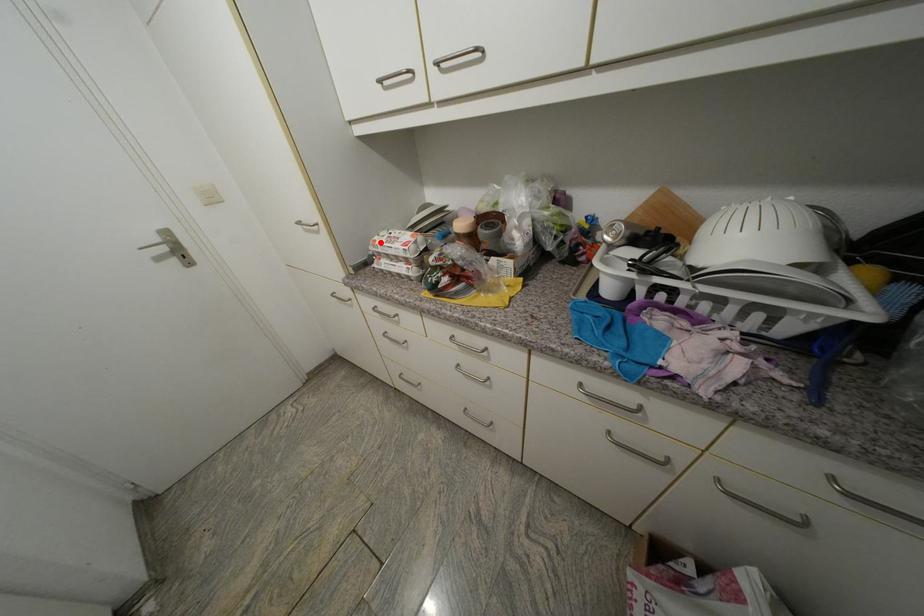
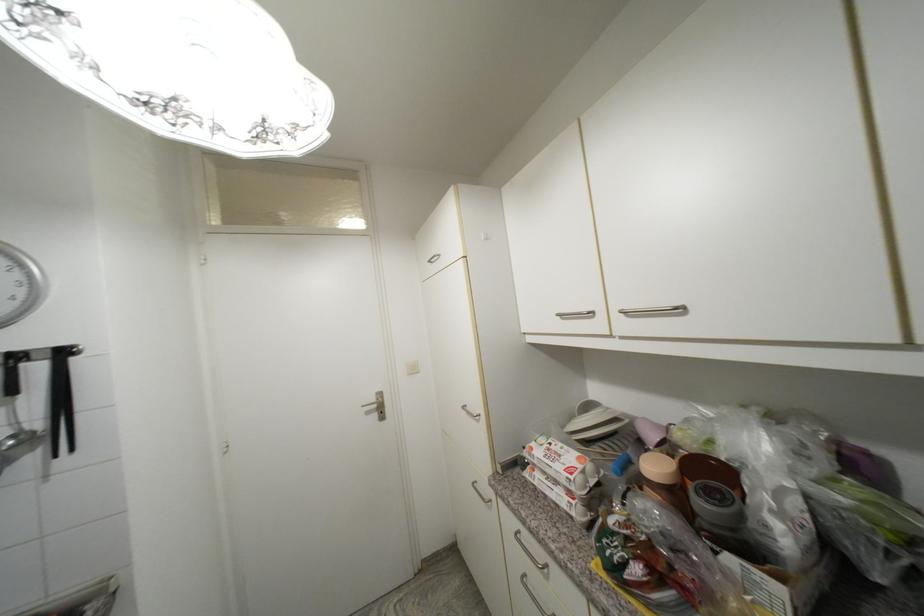
Find the pixel in the second image that matches the highlighted location in the first image.

(537, 451)